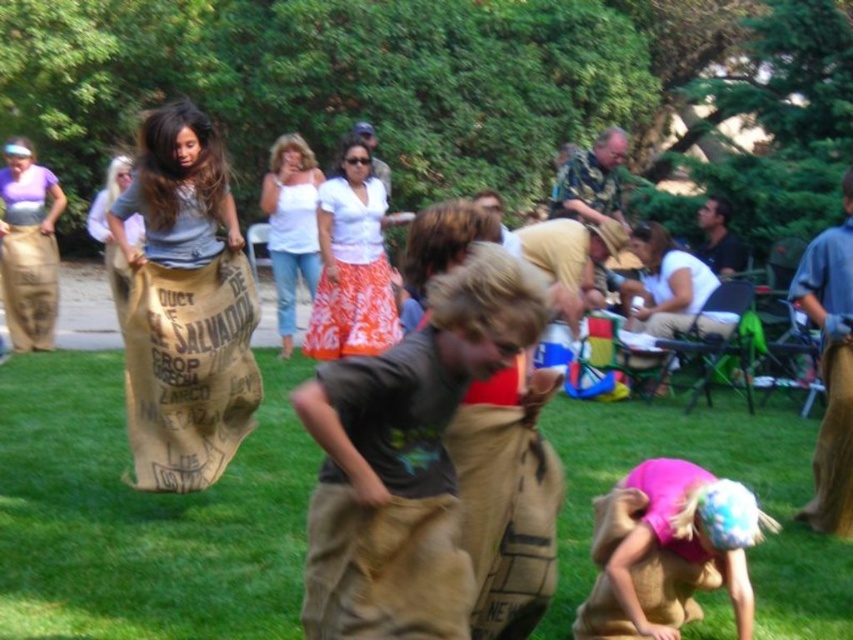
Question: Does green grass at lower center have a larger size compared to pink fabric at lower right?

Choices:
 (A) no
 (B) yes

Answer: (A)

Question: Among these points, which one is farthest from the camera?

Choices:
 (A) (788, 483)
 (B) (384, 557)
 (C) (248, 365)

Answer: (A)

Question: Is brown burlap sack at center below burlap sack at center?

Choices:
 (A) no
 (B) yes

Answer: (B)

Question: Which object is positioned farthest from the pink fabric at lower right?

Choices:
 (A) burlap sack at center
 (B) green grass at lower center
 (C) brown burlap sack at center

Answer: (A)

Question: Which of the following is the farthest from the observer?

Choices:
 (A) pink fabric at lower right
 (B) burlap sack at center
 (C) brown burlap sack at center
 (D) green grass at lower center

Answer: (B)

Question: Is the position of brown burlap sack at center more distant than that of pink fabric at lower right?

Choices:
 (A) yes
 (B) no

Answer: (B)